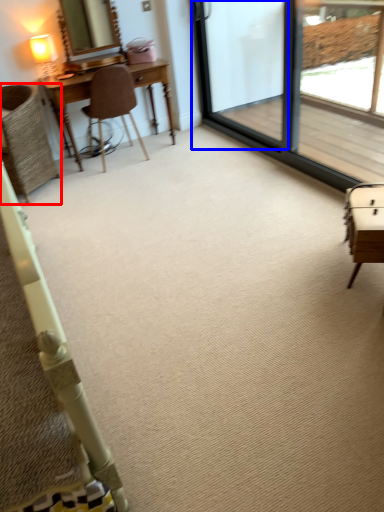
Question: Among these objects, which one is nearest to the camera, chair (highlighted by a red box) or screen door (highlighted by a blue box)?

Choices:
 (A) chair
 (B) screen door

Answer: (B)